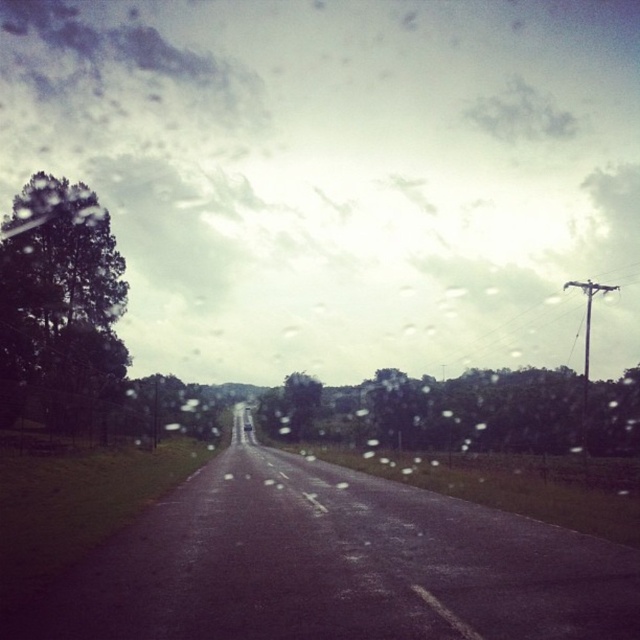
Consider the image. Between cloudy sky at upper center and metallic silver sedan at center, which one appears on the left side from the viewer's perspective?

metallic silver sedan at center

Between cloudy sky at upper center and metallic silver sedan at center, which one appears on the right side from the viewer's perspective?

From the viewer's perspective, cloudy sky at upper center appears more on the right side.

Is point (132, 353) positioned in front of point (244, 429)?

No, (132, 353) is further to viewer.

Identify the location of cloudy sky at upper center. This screenshot has width=640, height=640. (342, 173).